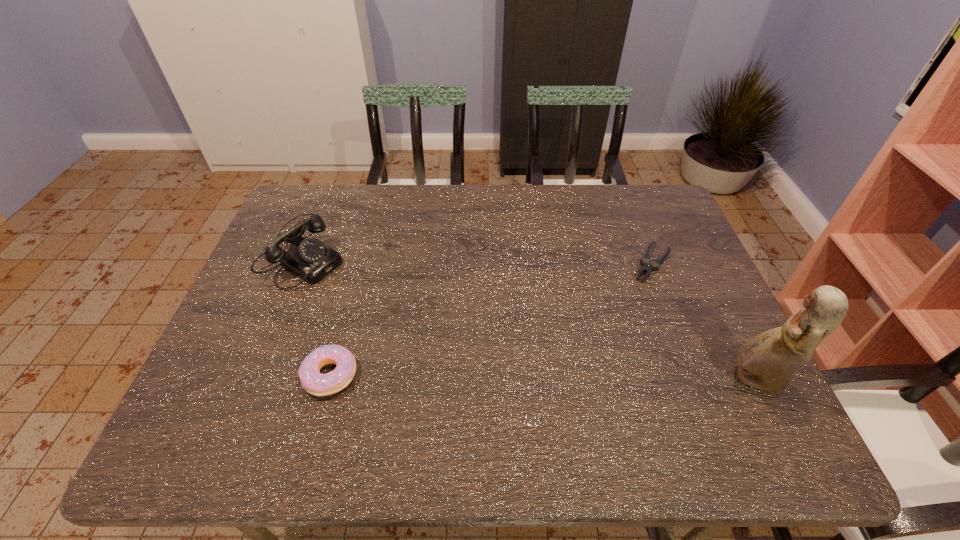
Locate an element on the screen. The width and height of the screenshot is (960, 540). vacant point located between the figurine and the third object from left to right is located at coordinates (703, 322).

The image size is (960, 540). What are the coordinates of `free space between the second tallest object and the doughnut` in the screenshot? It's located at (319, 312).

The height and width of the screenshot is (540, 960). I want to click on free point between the telephone and the pliers, so click(x=480, y=256).

Locate an element on the screen. vacant space that is in between the rightmost object and the shortest object is located at coordinates (703, 322).

You are a GUI agent. You are given a task and a screenshot of the screen. Output one action in this format:
    pyautogui.click(x=<x>, y=<y>)
    Task: Click on the free space between the figurine and the shortest object
    
    Given the screenshot: What is the action you would take?
    pyautogui.click(x=703, y=322)

Where is `free space between the third tallest object and the pliers`? free space between the third tallest object and the pliers is located at coordinates (492, 319).

At what (x,y) coordinates should I click in order to perform the action: click on vacant space in between the telephone and the rightmost object. Please return your answer as a coordinate pair (x, y). The image size is (960, 540). Looking at the image, I should click on pyautogui.click(x=531, y=315).

Locate an element on the screen. The image size is (960, 540). unoccupied area between the third tallest object and the shortest object is located at coordinates (492, 319).

Image resolution: width=960 pixels, height=540 pixels. What are the coordinates of `vacant area between the tallest object and the doughnut` in the screenshot? It's located at (541, 378).

You are a GUI agent. You are given a task and a screenshot of the screen. Output one action in this format:
    pyautogui.click(x=<x>, y=<y>)
    Task: Click on the blank region between the rightmost object and the third object from left to right
    The height and width of the screenshot is (540, 960).
    Given the screenshot: What is the action you would take?
    pyautogui.click(x=703, y=322)